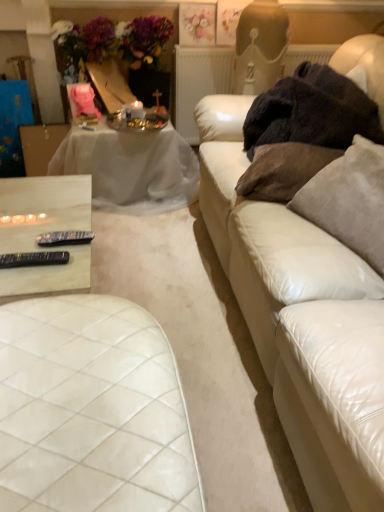
Find the location of a particular element. Image resolution: width=384 pixels, height=512 pixels. free point above white quilted leather ottoman at lower left (from a real-world perspective) is located at coordinates (77, 385).